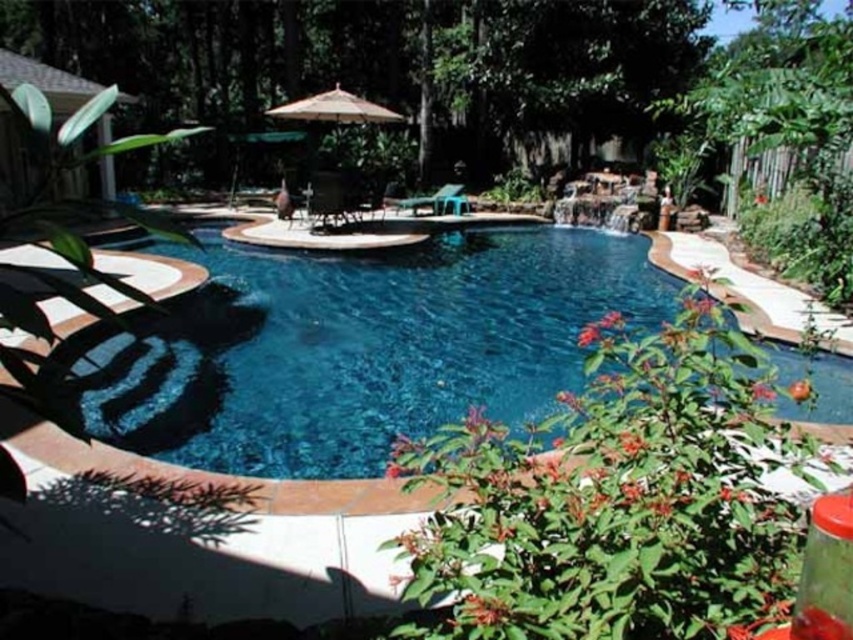
Is clear blue water at center above black plastic chair at center?

No, clear blue water at center is not above black plastic chair at center.

Which of these two, clear blue water at center or black plastic chair at center, stands shorter?

black plastic chair at center

Locate an element on the screen. clear blue water at center is located at coordinates (357, 348).

This screenshot has width=853, height=640. What are the coordinates of `clear blue water at center` in the screenshot? It's located at (357, 348).

Which is in front, point (206, 406) or point (415, 212)?

Positioned in front is point (206, 406).

Does point (157, 404) come closer to viewer compared to point (412, 198)?

Yes, it is.

Image resolution: width=853 pixels, height=640 pixels. What do you see at coordinates (357, 348) in the screenshot? I see `clear blue water at center` at bounding box center [357, 348].

The image size is (853, 640). Find the location of `clear blue water at center`. clear blue water at center is located at coordinates (357, 348).

Who is more distant from viewer, (357, 100) or (331, 177)?

Point (357, 100)

Is beige fabric umbrella at center further to camera compared to black plastic chair at center?

No, beige fabric umbrella at center is closer to the viewer.

I want to click on beige fabric umbrella at center, so click(335, 108).